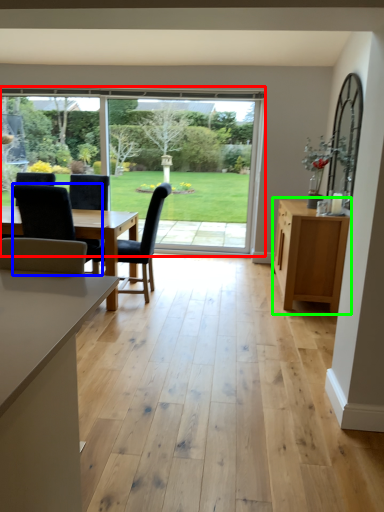
Question: Considering the real-world distances, which object is closest to window (highlighted by a red box)? chair (highlighted by a blue box) or cabinetry (highlighted by a green box).

Choices:
 (A) chair
 (B) cabinetry

Answer: (B)